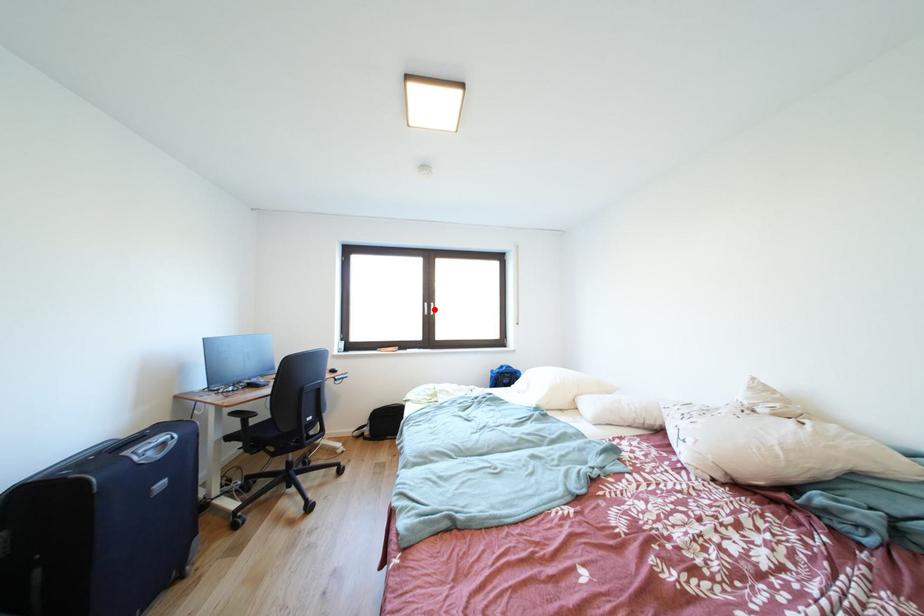
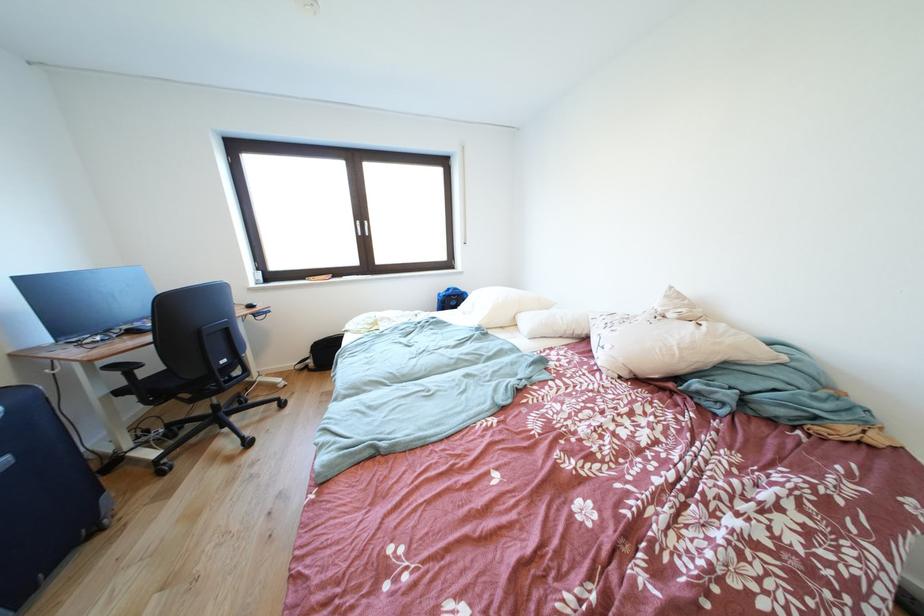
In the second image, find the point that corresponds to the highlighted location in the first image.

(367, 228)